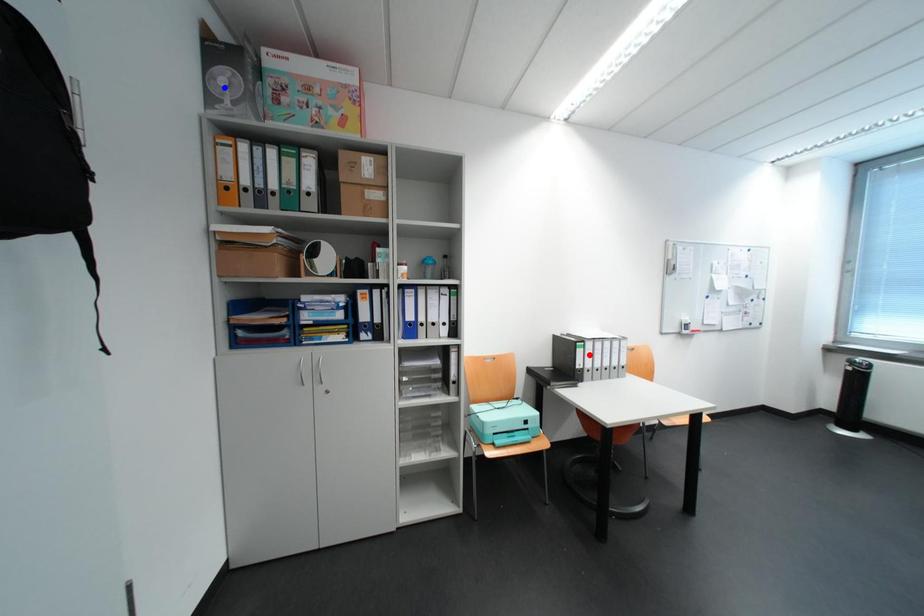
Question: Two points are marked on the image. Which point is closer to the camera?

Choices:
 (A) Blue point is closer.
 (B) Red point is closer.

Answer: (A)